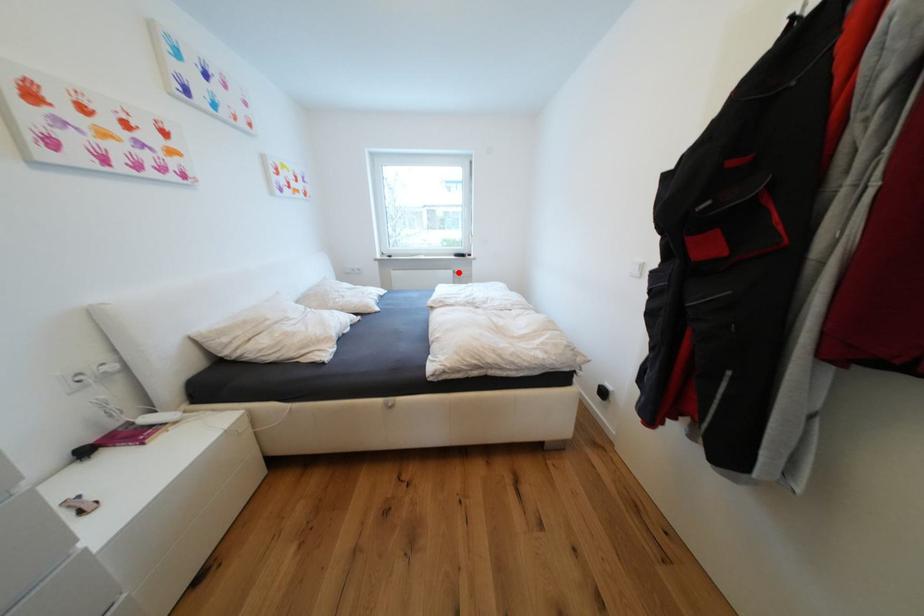
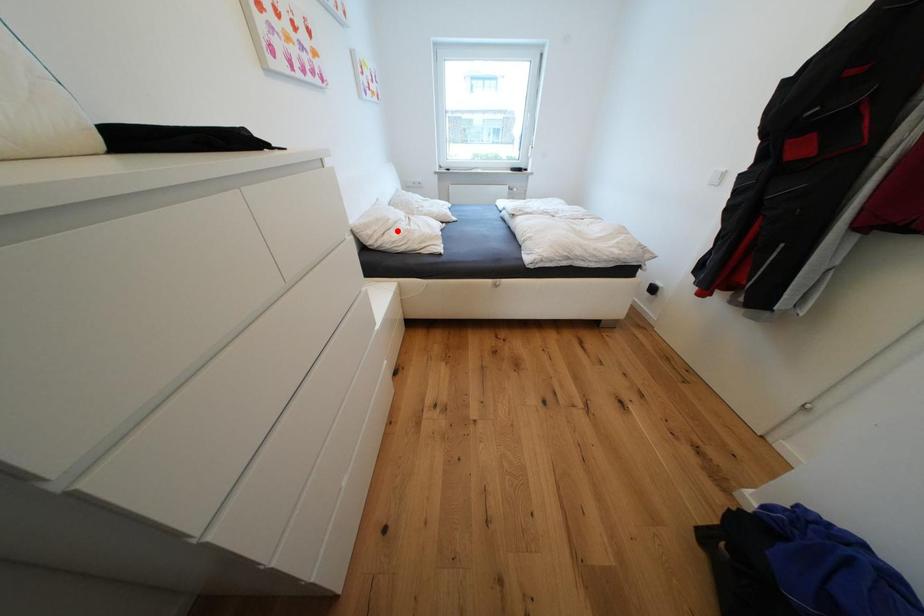
I am providing you with two images of the same scene from different viewpoints. A red point is marked on the first image and another point is marked on the second image. Is the marked point in image1 the same physical position as the marked point in image2?

No